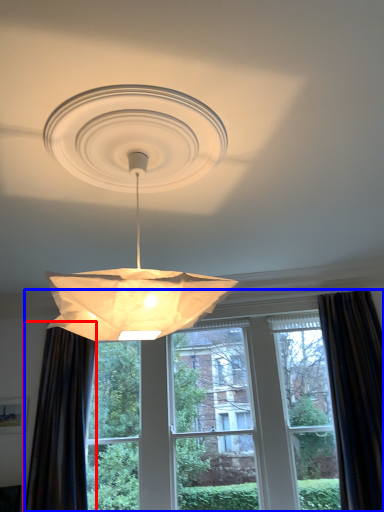
Question: Among these objects, which one is nearest to the camera, curtain (highlighted by a red box) or window (highlighted by a blue box)?

Choices:
 (A) curtain
 (B) window

Answer: (A)